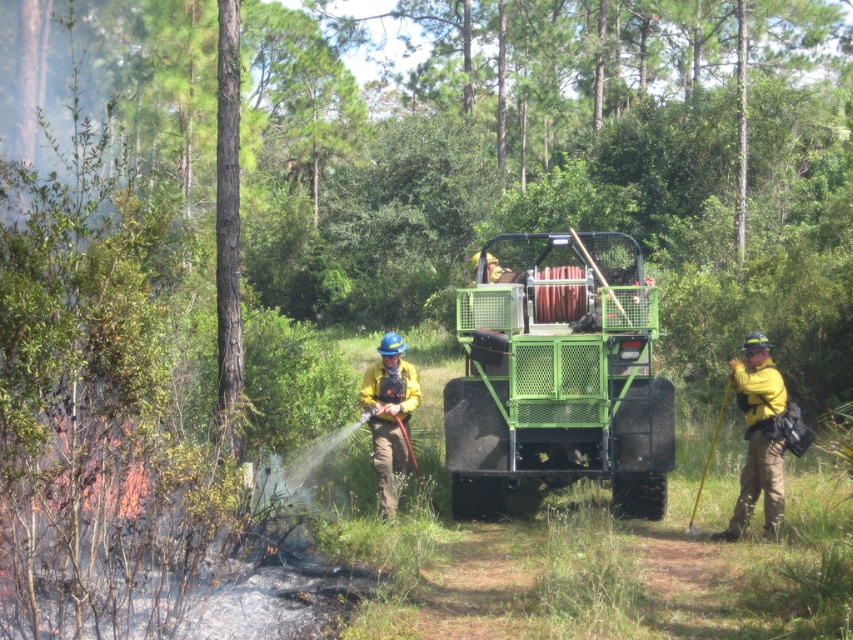
Between yellow hard hat at right and yellow fabric fireman at center, which one is positioned higher?

yellow fabric fireman at center is above.

Does point (778, 410) come closer to viewer compared to point (381, 422)?

That is True.

Is point (764, 515) positioned in front of point (381, 419)?

That is True.

Locate an element on the screen. This screenshot has width=853, height=640. yellow hard hat at right is located at coordinates (758, 436).